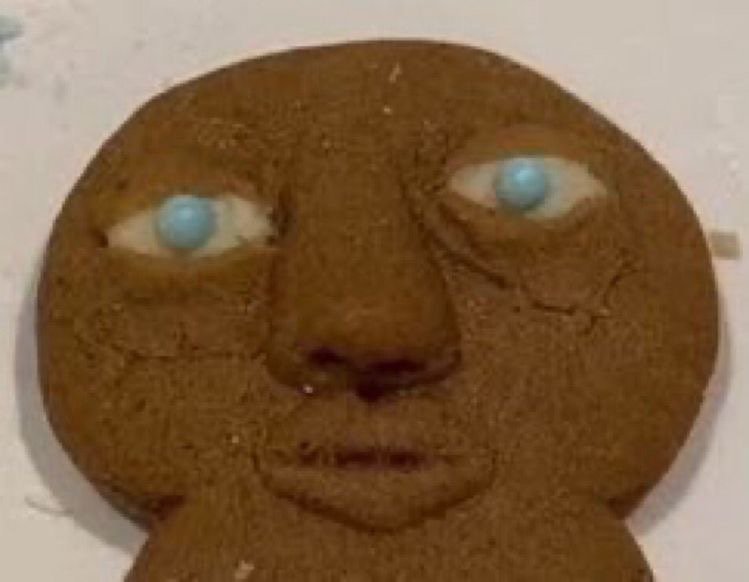
Locate an element on the screen. This screenshot has height=582, width=749. eggshell white countertop is located at coordinates (184, 41).